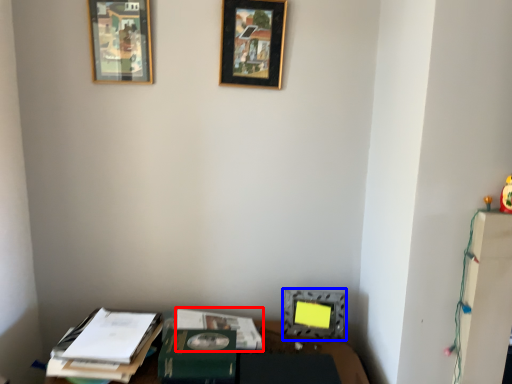
Question: Which object is closer to the camera taking this photo, journal (highlighted by a red box) or picture frame (highlighted by a blue box)?

Choices:
 (A) journal
 (B) picture frame

Answer: (A)